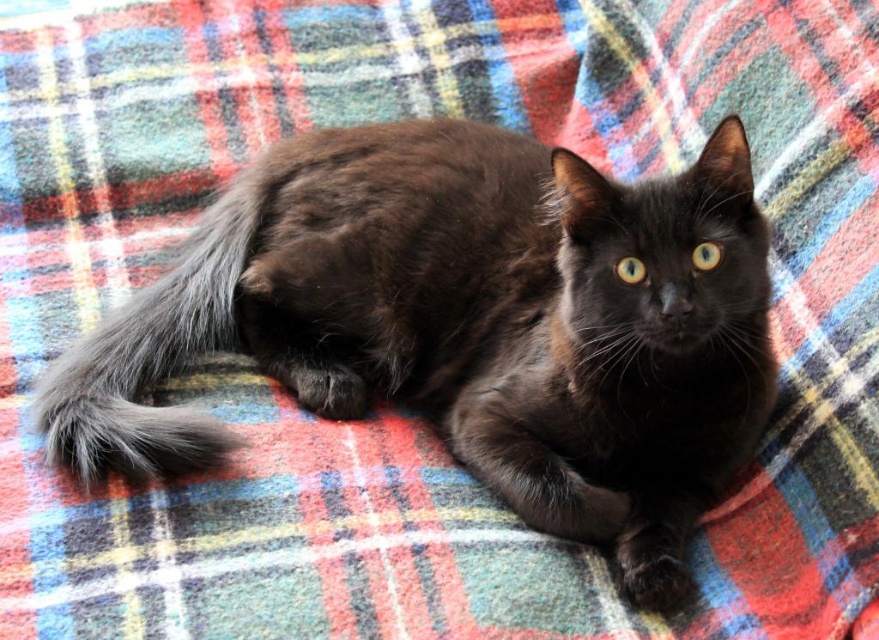
Question: Which point is closer to the camera?

Choices:
 (A) gray fluffy tail at lower left
 (B) shiny black cat at center

Answer: (B)

Question: Is shiny black cat at center to the right of gray fluffy tail at lower left from the viewer's perspective?

Choices:
 (A) yes
 (B) no

Answer: (A)

Question: Among these objects, which one is farthest from the camera?

Choices:
 (A) shiny black cat at center
 (B) gray fluffy tail at lower left

Answer: (B)

Question: From the image, what is the correct spatial relationship of shiny black cat at center in relation to gray fluffy tail at lower left?

Choices:
 (A) above
 (B) below

Answer: (A)

Question: Which of the following is the farthest from the observer?

Choices:
 (A) shiny black cat at center
 (B) gray fluffy tail at lower left

Answer: (B)

Question: Is shiny black cat at center positioned before gray fluffy tail at lower left?

Choices:
 (A) yes
 (B) no

Answer: (A)